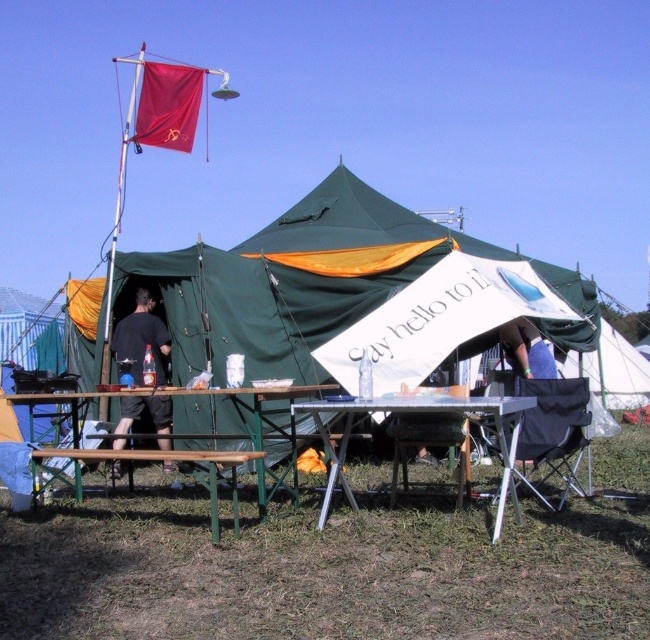
You are a guest at the event and want to sit down. You see the metallic silver table at center and the black fabric chair at lower right. Which one is lower to the ground so you can sit comfortably?

The metallic silver table at center is shorter than the black fabric chair at lower right, so you should sit on the black fabric chair at lower right because it is higher and more comfortable for sitting.

You are setting up a booth for an event and need to place a 1.2 meter wide banner between the metallic silver table at center and the black fabric chair at lower right. Will the banner fit horizontally between them?

The metallic silver table at center is wider than the black fabric chair at lower right. Since the banner is 1.2 meters wide, we need to know the exact width of the space between them to determine if it fits. However, the description only states that the table is wider than the chair, but doesn

You are standing at the center of the scene. Where is the black fabric chair at lower right located relative to your position?

The black fabric chair at lower right is located at point (552,433) relative to the scene center.